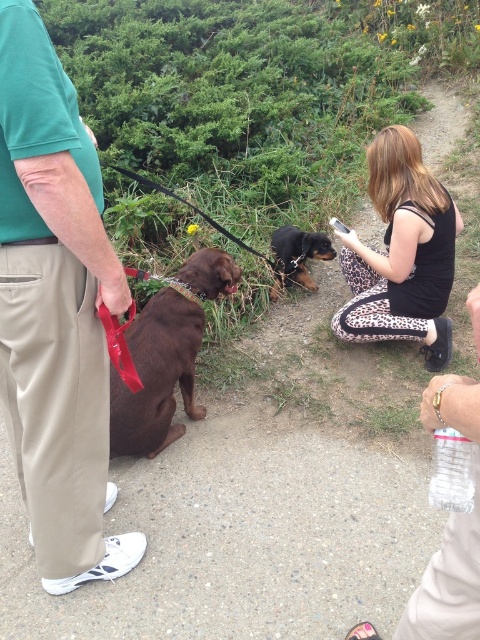
Question: Which object is farther from the camera taking this photo?

Choices:
 (A) black leopard print pants at center
 (B) black and tan fur at center

Answer: (B)

Question: In this image, where is green cotton shirt at left located relative to matte brown dog at left?

Choices:
 (A) left
 (B) right

Answer: (A)

Question: Is green cotton shirt at left positioned behind black and tan fur at center?

Choices:
 (A) no
 (B) yes

Answer: (A)

Question: Is black leopard print pants at center to the right of matte brown dog at left from the viewer's perspective?

Choices:
 (A) no
 (B) yes

Answer: (B)

Question: Among these points, which one is farthest from the camera?

Choices:
 (A) (28, 29)
 (B) (179, 333)
 (C) (127, 172)
 (D) (300, 275)

Answer: (D)

Question: Which point appears closest to the camera in this image?

Choices:
 (A) (84, 545)
 (B) (162, 413)
 (C) (159, 186)
 (D) (356, 237)

Answer: (A)